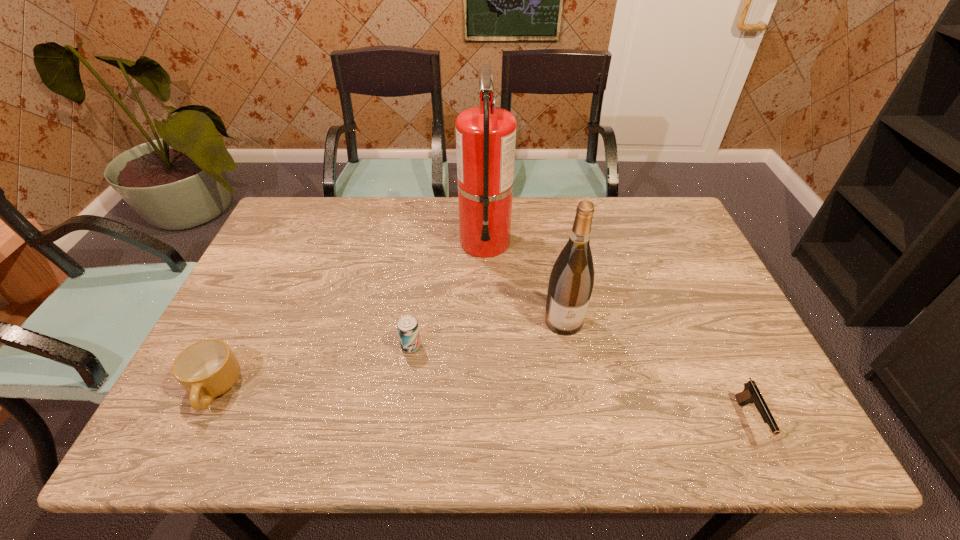
Where is `free space at the near edge of the desktop`? free space at the near edge of the desktop is located at coordinates (308, 436).

The width and height of the screenshot is (960, 540). Identify the location of free space at the left edge of the desktop. (236, 388).

The height and width of the screenshot is (540, 960). I want to click on free region at the right edge, so click(748, 362).

The height and width of the screenshot is (540, 960). What are the coordinates of `vacant space at the far left corner of the desktop` in the screenshot? It's located at (296, 198).

What are the coordinates of `free space at the far right corner` in the screenshot? It's located at (642, 204).

The width and height of the screenshot is (960, 540). What are the coordinates of `blank region between the farthest object and the pistol` in the screenshot? It's located at (617, 331).

The height and width of the screenshot is (540, 960). I want to click on unoccupied position between the fourth shortest object and the mug, so click(389, 355).

I want to click on empty space that is in between the wine bottle and the tallest object, so click(x=524, y=281).

Where is `empty location between the second object from right to left and the mug`? The height and width of the screenshot is (540, 960). empty location between the second object from right to left and the mug is located at coordinates (389, 355).

The height and width of the screenshot is (540, 960). Find the location of `vacant space in between the tallest object and the fourth shortest object`. vacant space in between the tallest object and the fourth shortest object is located at coordinates (524, 281).